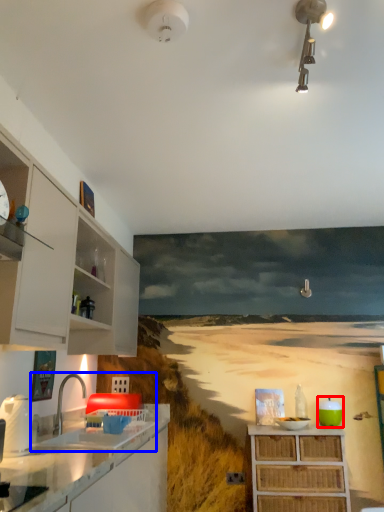
Question: Among these objects, which one is farthest to the camera, appliance (highlighted by a red box) or sink (highlighted by a blue box)?

Choices:
 (A) appliance
 (B) sink

Answer: (A)